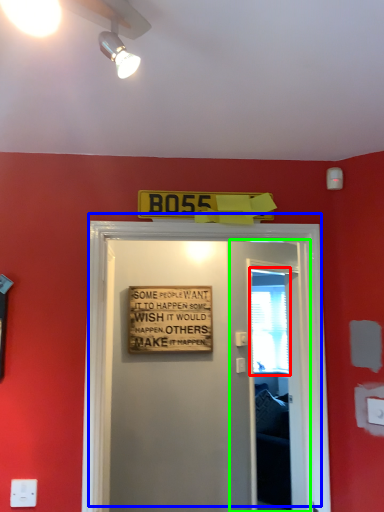
Question: Which is nearer to the window screen (highlighted by a red box)? door (highlighted by a blue box) or screen door (highlighted by a green box).

Choices:
 (A) door
 (B) screen door

Answer: (B)